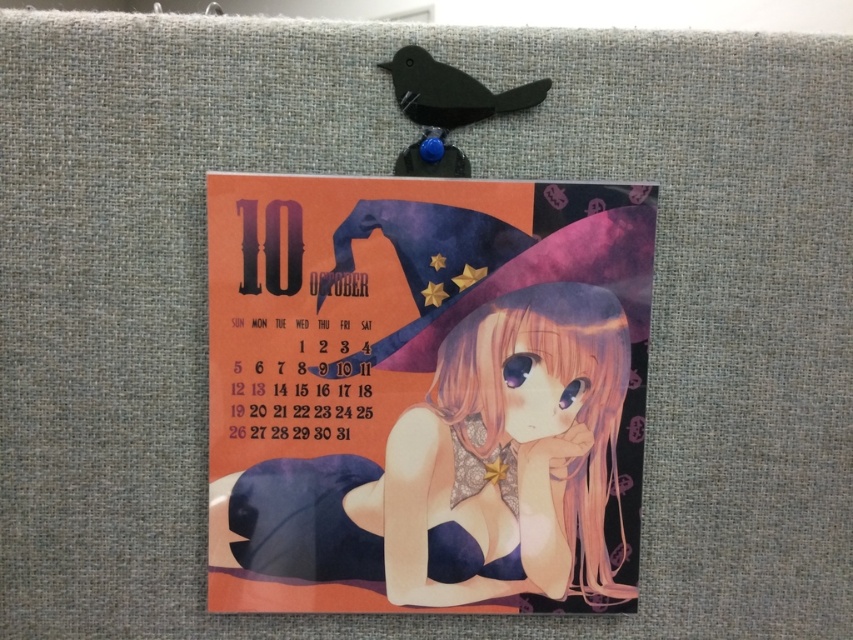
Question: Does smooth paper calendar at center appear on the right side of matte black bird at upper center?

Choices:
 (A) no
 (B) yes

Answer: (A)

Question: Which object is closer to the camera taking this photo?

Choices:
 (A) smooth paper calendar at center
 (B) matte black bird at upper center

Answer: (B)

Question: Among these points, which one is farthest from the camera?

Choices:
 (A) (514, 93)
 (B) (405, 545)

Answer: (B)

Question: Observing the image, what is the correct spatial positioning of smooth paper calendar at center in reference to matte black bird at upper center?

Choices:
 (A) right
 (B) left

Answer: (B)

Question: Does smooth paper calendar at center appear on the left side of matte black bird at upper center?

Choices:
 (A) yes
 (B) no

Answer: (A)